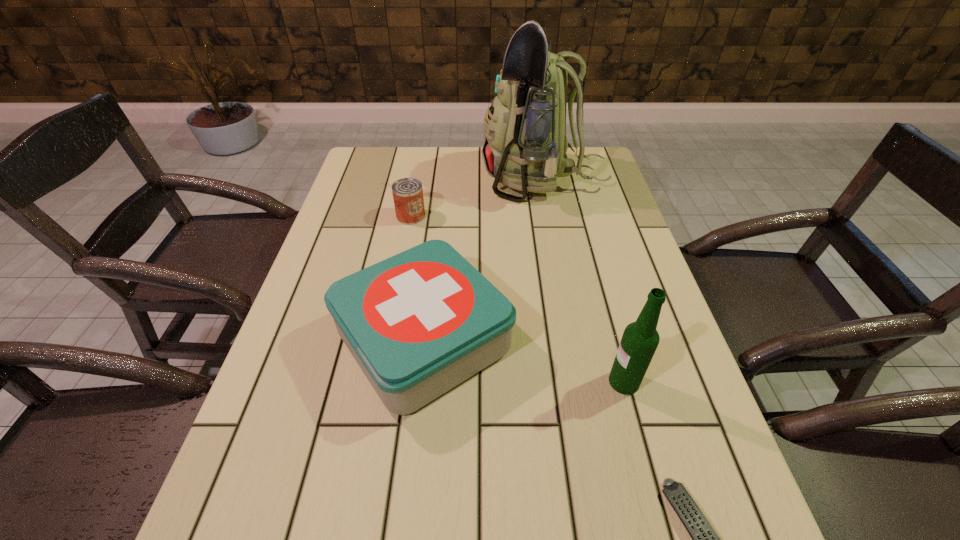
At what (x,y) coordinates should I click in order to perform the action: click on vacant space at the far left corner. Please return your answer as a coordinate pair (x, y). This screenshot has width=960, height=540. Looking at the image, I should click on (384, 174).

You are a GUI agent. You are given a task and a screenshot of the screen. Output one action in this format:
    pyautogui.click(x=<x>, y=<y>)
    Task: Click on the free space at the far right corner
    The image size is (960, 540).
    Given the screenshot: What is the action you would take?
    pyautogui.click(x=577, y=176)

This screenshot has height=540, width=960. I want to click on unoccupied area between the first-aid kit and the backpack, so click(484, 260).

The width and height of the screenshot is (960, 540). Find the location of `vacant space that is in between the tallest object and the first-aid kit`. vacant space that is in between the tallest object and the first-aid kit is located at coordinates click(484, 260).

Where is `vacant space in between the tallest object and the first-aid kit`? The height and width of the screenshot is (540, 960). vacant space in between the tallest object and the first-aid kit is located at coordinates (484, 260).

The width and height of the screenshot is (960, 540). I want to click on free spot between the backpack and the beer bottle, so click(584, 280).

Where is `object that is the second closest to the tallest object`? Image resolution: width=960 pixels, height=540 pixels. object that is the second closest to the tallest object is located at coordinates (419, 323).

Identify which object is located as the nearest to the remote control. Please provide its 2D coordinates. Your answer should be formatted as a tuple, i.e. [(x, y)], where the tuple contains the x and y coordinates of a point satisfying the conditions above.

[(640, 339)]

Locate an element on the screen. blank area in the image that satisfies the following two spatial constraints: 1. on the front side of the fourth tallest object; 2. on the right side of the third shortest object is located at coordinates (388, 340).